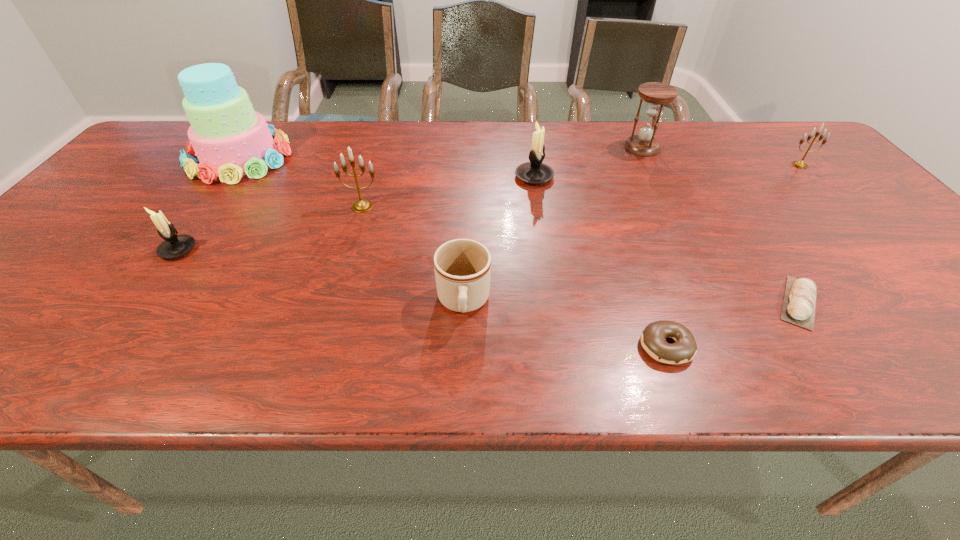
I want to click on the farther gold candelabrum, so click(799, 164).

You are a GUI agent. You are given a task and a screenshot of the screen. Output one action in this format:
    pyautogui.click(x=<x>, y=<y>)
    Task: Click on the sixth object from right to left
    
    Given the screenshot: What is the action you would take?
    pyautogui.click(x=462, y=267)

Find the location of `mug`. mug is located at coordinates [x=462, y=267].

I want to click on doughnut, so click(x=653, y=339).

You are a GUI agent. You are given a task and a screenshot of the screen. Output one action in this format:
    pyautogui.click(x=<x>, y=<y>)
    Task: Click on the brown doughnut
    
    Given the screenshot: What is the action you would take?
    pyautogui.click(x=653, y=339)

Image resolution: width=960 pixels, height=540 pixels. Identify the location of the second object from right to left. (799, 303).

The width and height of the screenshot is (960, 540). I want to click on free point located 0.160m on the front of the blue cake, so click(x=193, y=224).

Where is `vacant space located 0.160m on the right of the hourglass`? This screenshot has height=540, width=960. vacant space located 0.160m on the right of the hourglass is located at coordinates (713, 148).

Image resolution: width=960 pixels, height=540 pixels. What are the coordinates of `free space located on the left of the fifth object from left to right` in the screenshot? It's located at (464, 177).

What are the coordinates of `free space located on the left of the third object from left to right` in the screenshot? It's located at (324, 206).